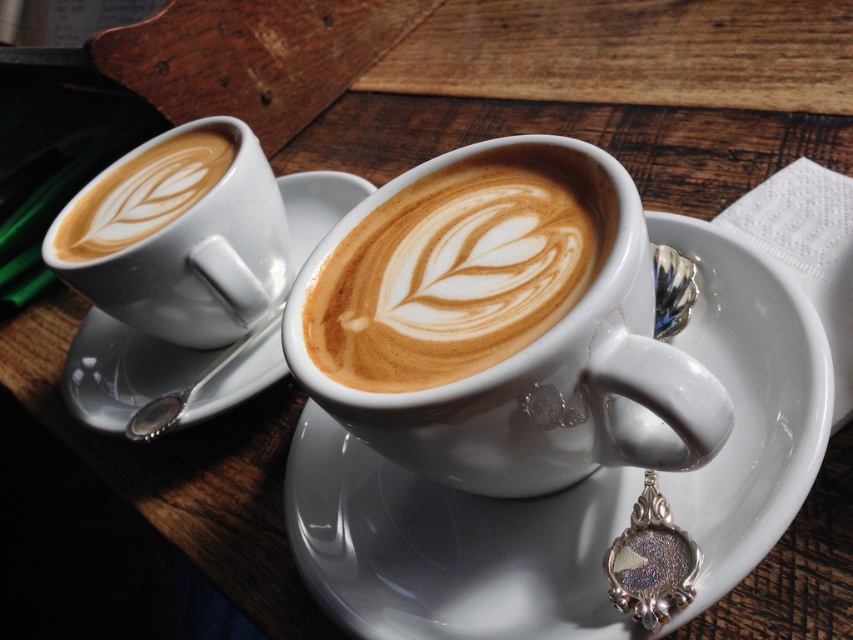
Question: Is white glossy saucer at center smaller than white ceramic saucer at upper left?

Choices:
 (A) no
 (B) yes

Answer: (B)

Question: Among these points, which one is nearest to the camera?

Choices:
 (A) (705, 356)
 (B) (479, 328)
 (C) (73, 259)

Answer: (B)

Question: Among these points, which one is nearest to the camera?

Choices:
 (A) (263, 358)
 (B) (473, 193)

Answer: (B)

Question: Is white glossy saucer at center smaller than white matte cup at center?

Choices:
 (A) yes
 (B) no

Answer: (B)

Question: Which of the following is the farthest from the observer?

Choices:
 (A) white matte cup at center
 (B) latte art at upper left
 (C) white ceramic saucer at upper left
 (D) white glossy saucer at center

Answer: (C)

Question: Is white matte cup at center to the left of latte art at upper left from the viewer's perspective?

Choices:
 (A) no
 (B) yes

Answer: (A)